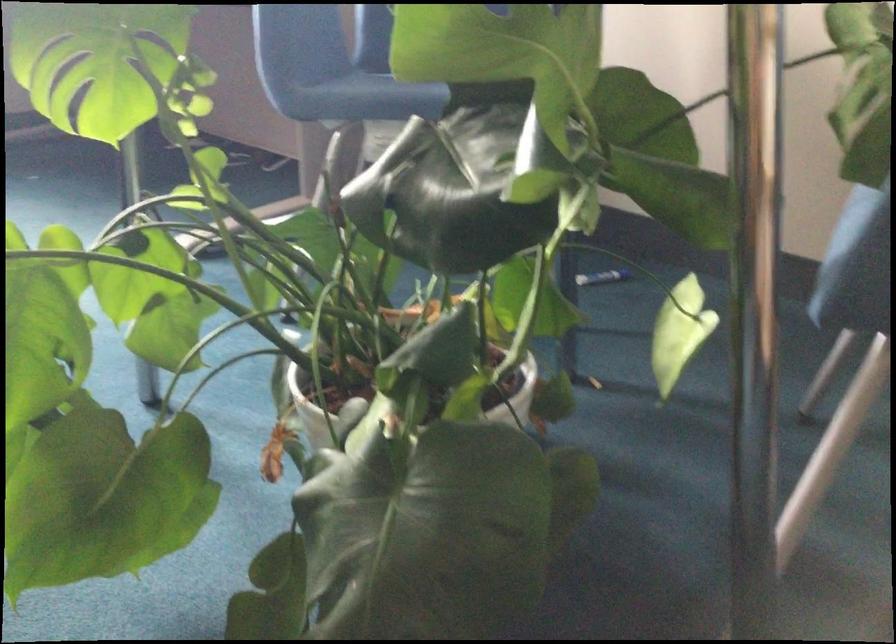
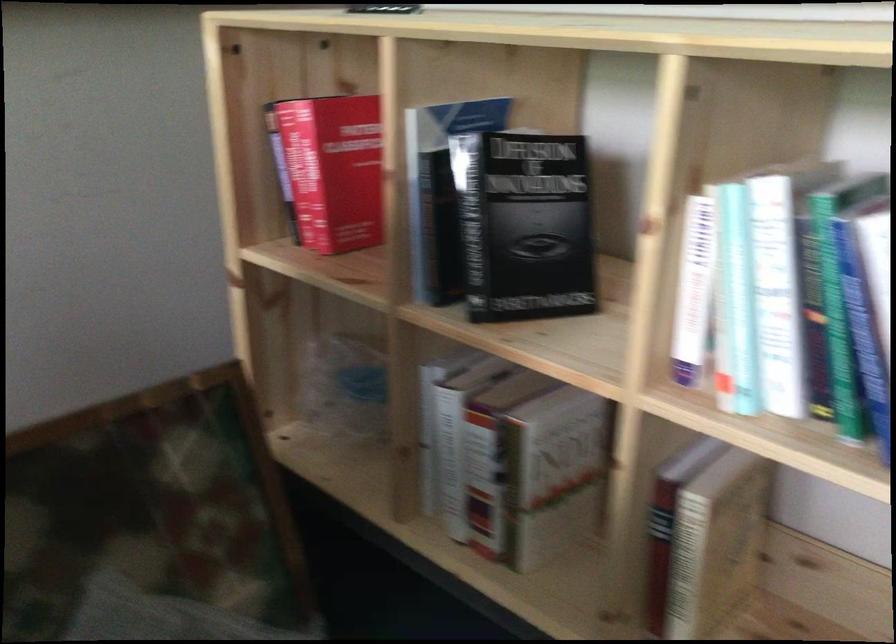
Based on the continuous images, in which direction is the camera rotating?

The camera rotated toward right-down.